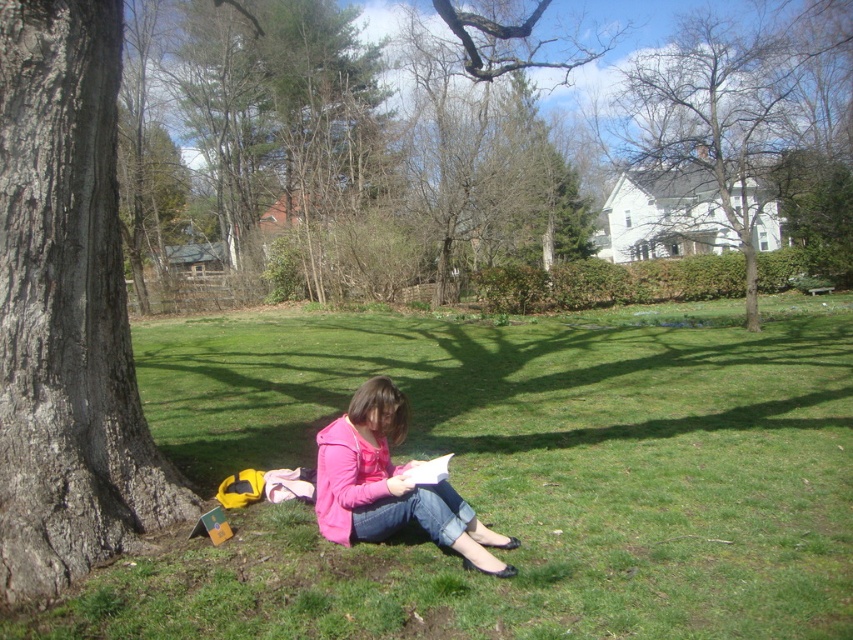
Question: Is green grass at lower left thinner than pink matte jacket at center?

Choices:
 (A) no
 (B) yes

Answer: (A)

Question: Which point is farther to the camera?

Choices:
 (A) gray textured bark at left
 (B) pink matte jacket at center
 (C) green grass at lower left
 (D) bare branches at upper center

Answer: (D)

Question: Does gray textured bark at left appear on the left side of bare branches at upper center?

Choices:
 (A) yes
 (B) no

Answer: (A)

Question: Which point is farther to the camera?

Choices:
 (A) (386, 376)
 (B) (714, 141)
 (C) (83, 109)
 (D) (637, 605)

Answer: (B)

Question: Estimate the real-world distances between objects in this image. Which object is farther from the green grass at lower left?

Choices:
 (A) gray textured bark at left
 (B) bare branches at upper center
 (C) pink matte jacket at center

Answer: (B)

Question: Is green grass at lower left positioned at the back of bare branches at upper center?

Choices:
 (A) yes
 (B) no

Answer: (B)